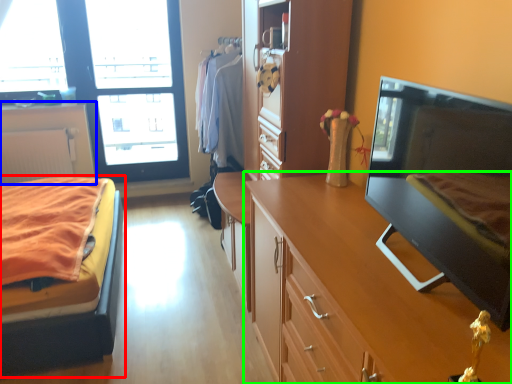
Question: Based on their relative distances, which object is nearer to bed (highlighted by a red box)? Choose from cabinetry (highlighted by a blue box) and cabinetry (highlighted by a green box).

Choices:
 (A) cabinetry
 (B) cabinetry

Answer: (B)